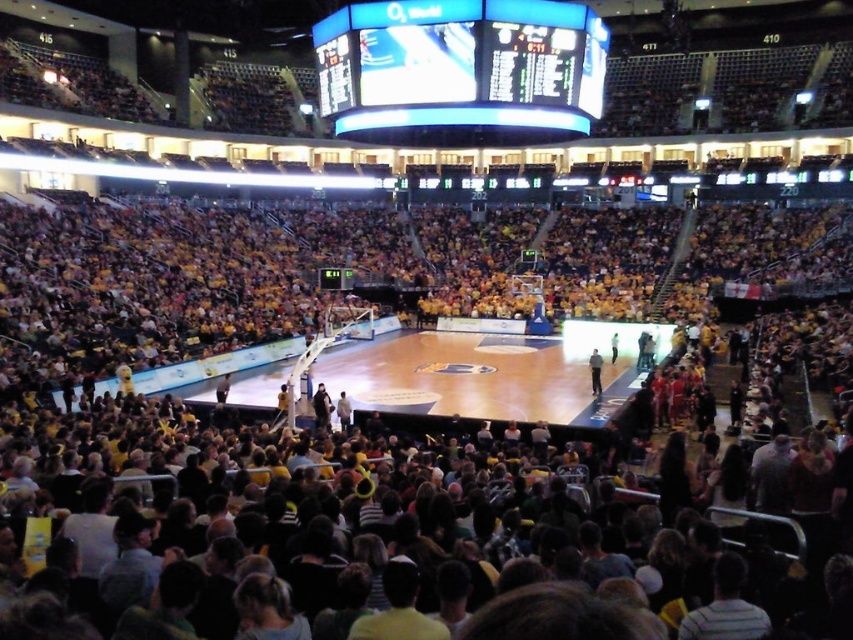
You are a photographer standing at the back of the arena. You want to take a photo of the wooden polished basketball court at center and the light blue jersey at center. Which object will appear larger in your photo?

The wooden polished basketball court at center will appear larger in the photo because it is taller than the light blue jersey at center.

You are a photographer positioned at the back of the arena. You want to capture a photo of the wooden polished basketball court at center and the blue led scoreboard at center in the same frame. Which object should you adjust your camera to focus on first to ensure both are in the shot?

The blue led scoreboard at center is to the right of the wooden polished basketball court at center, so you should focus on the wooden polished basketball court at center first to ensure both are in the frame.